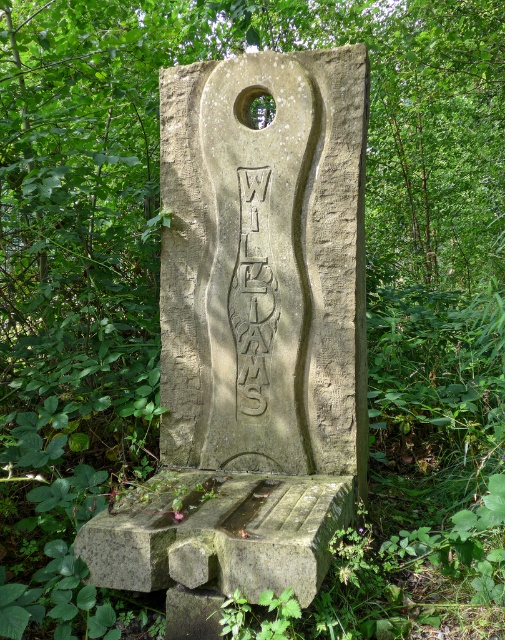
Is the position of stone carving at center less distant than that of carved stone text at center?

Yes, stone carving at center is in front of carved stone text at center.

Does stone carving at center appear over carved stone text at center?

Incorrect, stone carving at center is not positioned above carved stone text at center.

Who is more distant from viewer, (237, 198) or (252, 410)?

The point (252, 410) is behind.

Locate an element on the screen. The image size is (505, 640). stone carving at center is located at coordinates (251, 339).